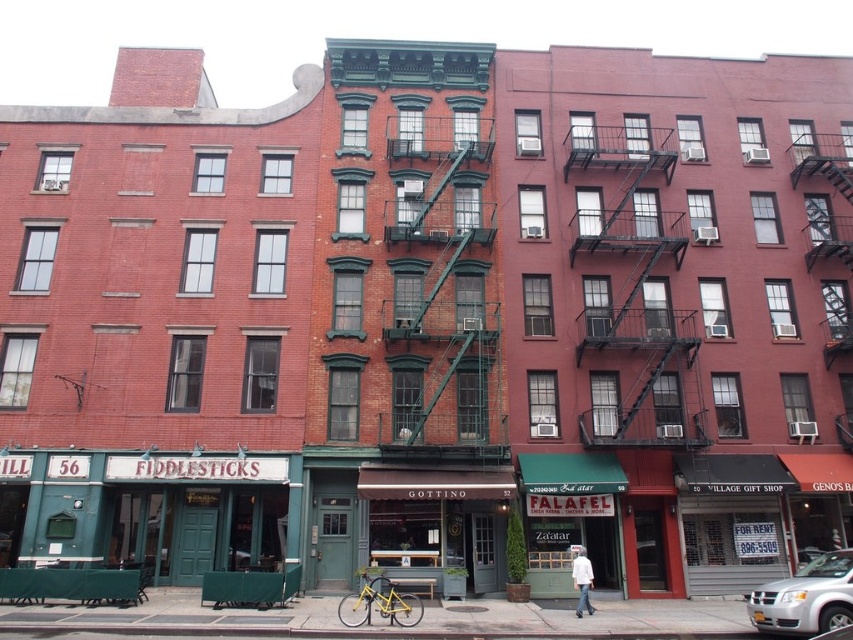
You are a pedestrian standing on the sidewalk in front of the building. You see a silver metallic van at lower right and a white cotton shirt at center. Which object is closer to you?

The silver metallic van at lower right is closer to you because it is in front of the white cotton shirt at center.